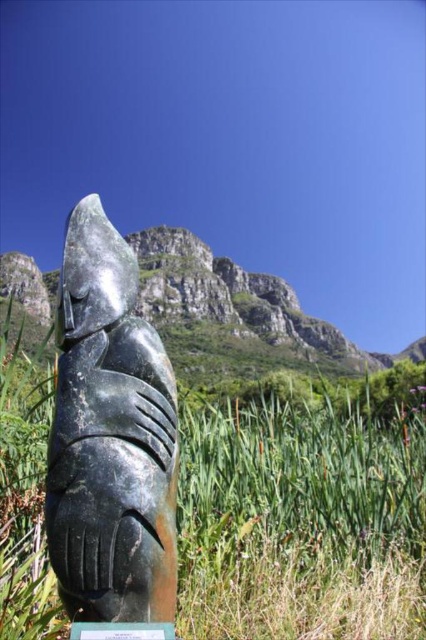
Question: Considering the real-world distances, which object is closest to the green grass at center?

Choices:
 (A) black polished stone totem at center
 (B) green stone plaque at center

Answer: (A)

Question: Where is black polished stone totem at center located in relation to green stone plaque at center in the image?

Choices:
 (A) left
 (B) right

Answer: (A)

Question: Which of the following is the farthest from the observer?

Choices:
 (A) (350, 476)
 (B) (114, 627)

Answer: (A)

Question: Does green grass at center have a lesser width compared to black polished stone totem at center?

Choices:
 (A) yes
 (B) no

Answer: (B)

Question: Which point is closer to the camera?

Choices:
 (A) black polished stone totem at center
 (B) green stone plaque at center
 (C) green grass at center

Answer: (B)

Question: Is green grass at center closer to camera compared to black polished stone totem at center?

Choices:
 (A) no
 (B) yes

Answer: (A)